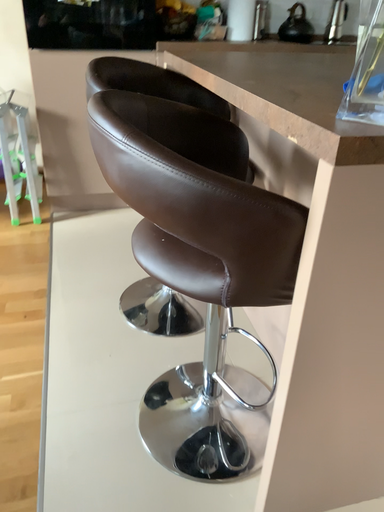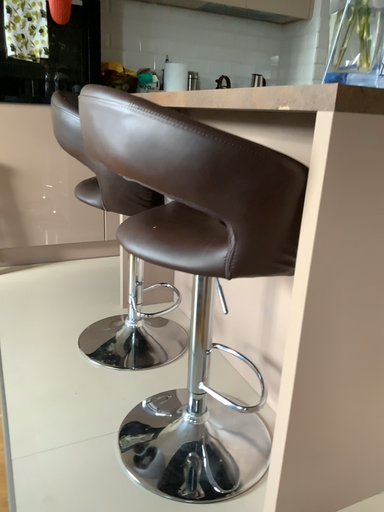
Question: How did the camera likely rotate when shooting the video?

Choices:
 (A) rotated right
 (B) rotated left

Answer: (A)